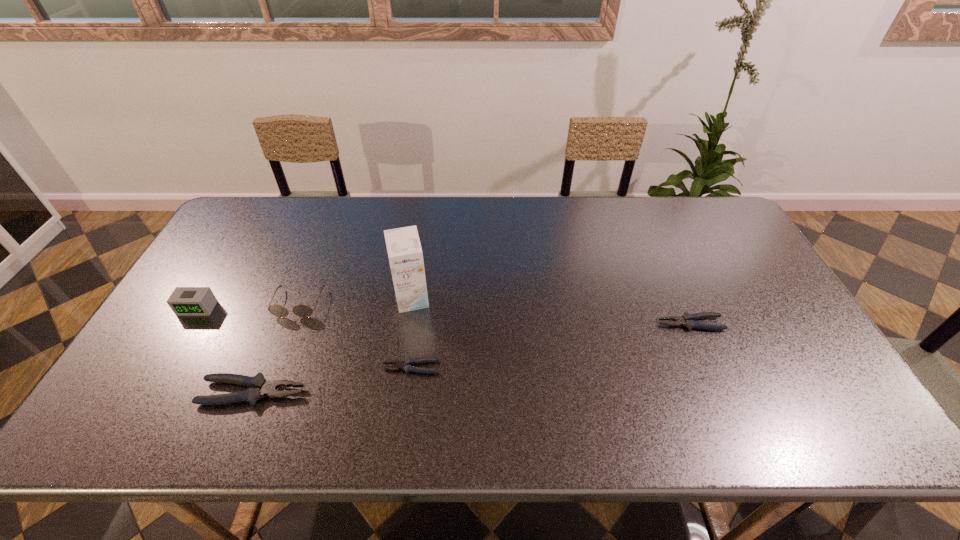
You are a GUI agent. You are given a task and a screenshot of the screen. Output one action in this format:
    pyautogui.click(x=<x>, y=<y>)
    Task: Click on the location for an additional pliers to make spacing equal
    Image resolution: width=960 pixels, height=540 pixels.
    Given the screenshot: What is the action you would take?
    pyautogui.click(x=557, y=345)